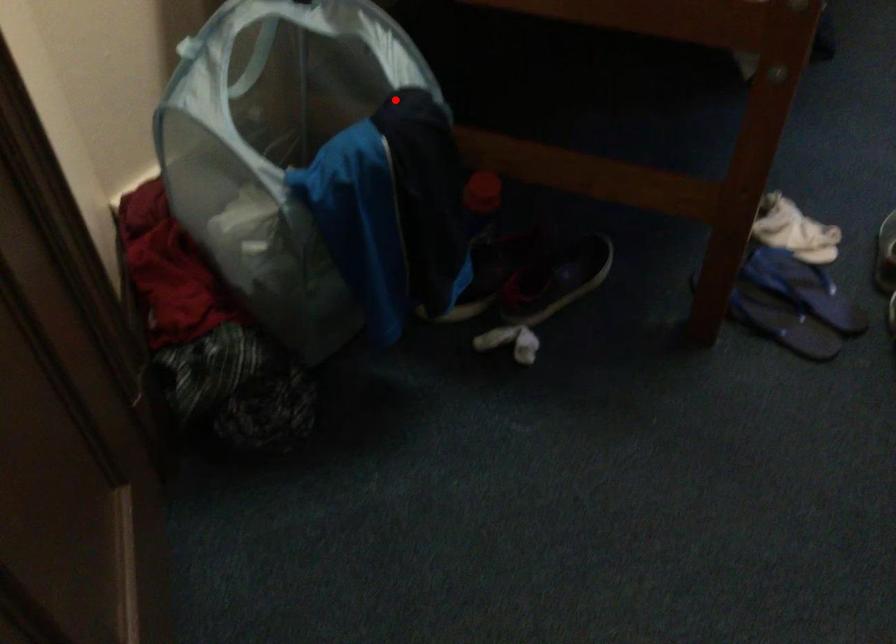
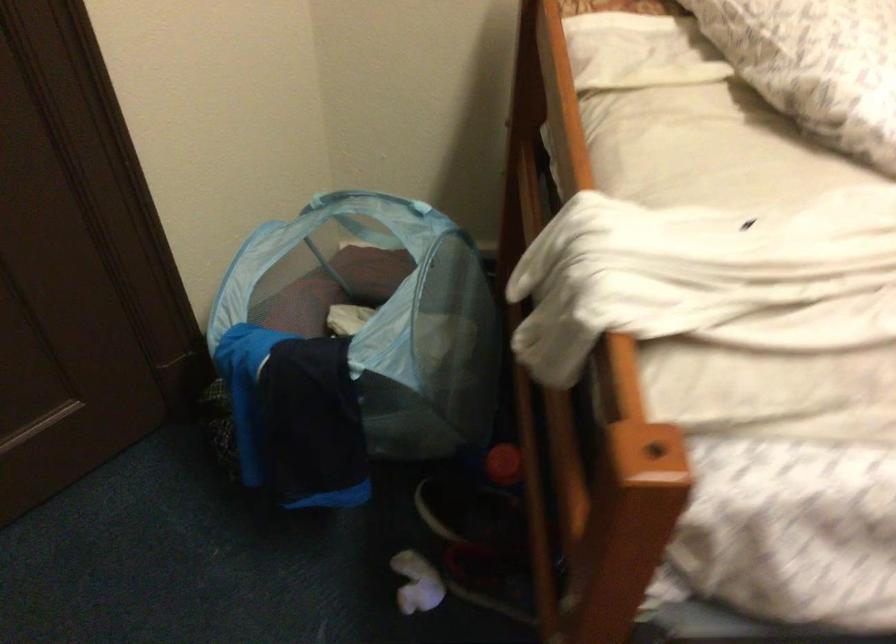
Where in the second image is the point corresponding to the highlighted location from the first image?

(354, 345)